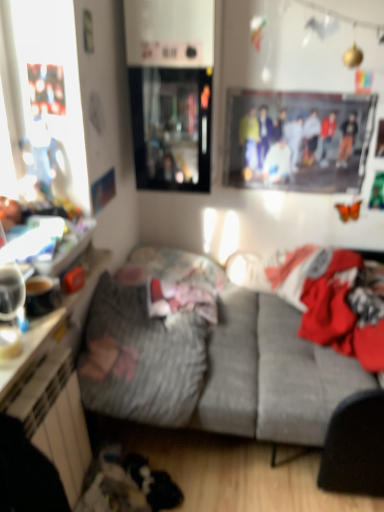
Question: Is gray fabric couch at center oriented towards transparent glass cabinet at upper center?

Choices:
 (A) no
 (B) yes

Answer: (A)

Question: Is gray fabric couch at center wider than transparent glass cabinet at upper center?

Choices:
 (A) no
 (B) yes

Answer: (B)

Question: Can you confirm if gray fabric couch at center is taller than transparent glass cabinet at upper center?

Choices:
 (A) no
 (B) yes

Answer: (A)

Question: Is the surface of gray fabric couch at center in direct contact with transparent glass cabinet at upper center?

Choices:
 (A) no
 (B) yes

Answer: (A)

Question: Does gray fabric couch at center lie in front of transparent glass cabinet at upper center?

Choices:
 (A) yes
 (B) no

Answer: (A)

Question: From the image's perspective, is printed fabric poster at upper center positioned above or below transparent glass cabinet at upper center?

Choices:
 (A) above
 (B) below

Answer: (B)

Question: In the image, is printed fabric poster at upper center positioned in front of or behind transparent glass cabinet at upper center?

Choices:
 (A) front
 (B) behind

Answer: (B)

Question: Does point (264, 164) appear closer or farther from the camera than point (195, 142)?

Choices:
 (A) closer
 (B) farther

Answer: (B)

Question: Is printed fabric poster at upper center situated inside transparent glass cabinet at upper center or outside?

Choices:
 (A) inside
 (B) outside

Answer: (B)

Question: Is gray fabric couch at center spatially inside red fabric laundry at center, or outside of it?

Choices:
 (A) outside
 (B) inside

Answer: (A)

Question: Would you say gray fabric couch at center is to the left or to the right of red fabric laundry at center in the picture?

Choices:
 (A) right
 (B) left

Answer: (B)

Question: Is gray fabric couch at center in front of or behind red fabric laundry at center in the image?

Choices:
 (A) front
 (B) behind

Answer: (A)

Question: From the image's perspective, is gray fabric couch at center above or below red fabric laundry at center?

Choices:
 (A) above
 (B) below

Answer: (B)

Question: Considering the positions of fluffy gray blanket at center and gray fabric couch at center in the image, is fluffy gray blanket at center taller or shorter than gray fabric couch at center?

Choices:
 (A) tall
 (B) short

Answer: (B)

Question: Does point (180, 330) appear closer or farther from the camera than point (307, 350)?

Choices:
 (A) farther
 (B) closer

Answer: (B)